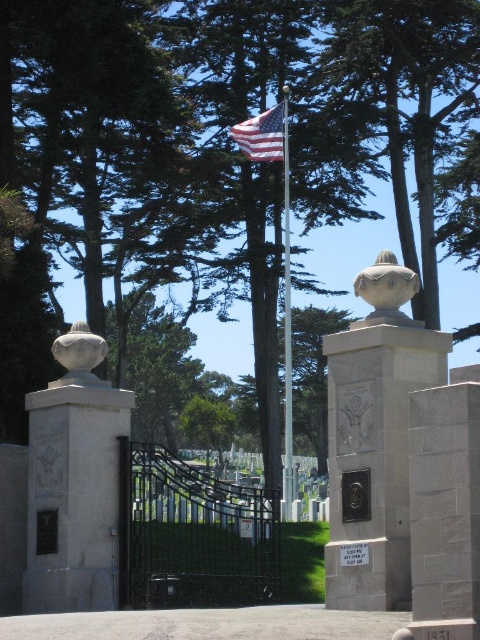
You are a visitor arriving at the cemetery entrance. You notice a white stone sculpture at center and a polished metal flag pole at center. Which object is positioned higher in the scene?

The white stone sculpture at center is above the polished metal flag pole at center, so it is positioned higher in the scene.

You are standing at the entrance of a cemetery and want to know how far you are from the point marked as point (357, 291). Can you determine the distance?

The distance between you and point (357, 291) is 155.65 feet.